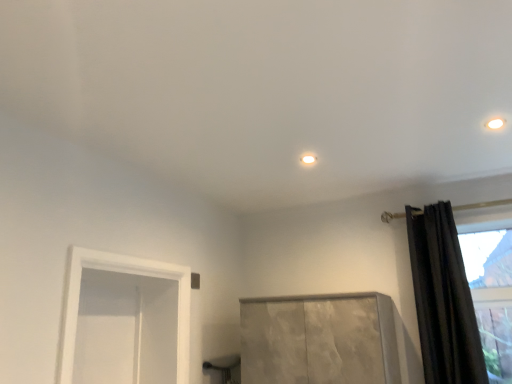
Question: In terms of size, does matte white light fixture at upper right, arranged as the first lighting when viewed from the front, appear bigger or smaller than white glossy light fixture at center, the second lighting positioned from the front?

Choices:
 (A) small
 (B) big

Answer: (B)

Question: In the image, is matte white light fixture at upper right, the second lighting when ordered from bottom to top, on the left side or the right side of white glossy light fixture at center, which appears as the first lighting when viewed from the left?

Choices:
 (A) left
 (B) right

Answer: (B)

Question: Estimate the real-world distances between objects in this image. Which object is closer to the matte white light fixture at upper right, which is the first lighting in right-to-left order?

Choices:
 (A) white glossy light fixture at center, which appears as the first lighting when viewed from the left
 (B) black velvet curtain at right

Answer: (A)

Question: Which object is positioned closest to the white glossy light fixture at center, positioned as the second lighting in top-to-bottom order?

Choices:
 (A) matte white light fixture at upper right, positioned as the 1th lighting in top-to-bottom order
 (B) black velvet curtain at right

Answer: (A)